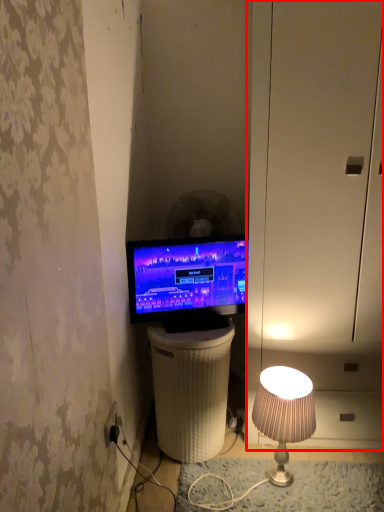
Question: From the image's perspective, considering the relative positions of dresser (annotated by the red box) and mechanical fan in the image provided, where is dresser (annotated by the red box) located with respect to the staircase?

Choices:
 (A) above
 (B) below

Answer: (B)